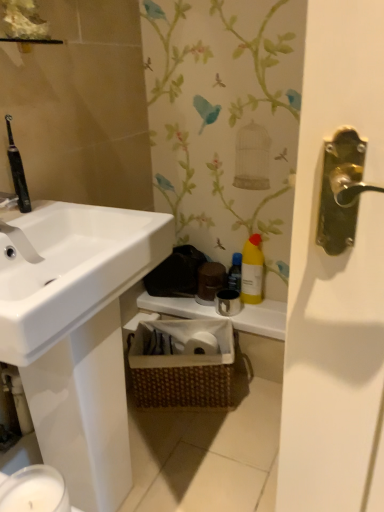
Question: Is the surface of yellow matte bottle at center in direct contact with white matte counter top at center?

Choices:
 (A) no
 (B) yes

Answer: (A)

Question: Considering the relative sizes of yellow matte bottle at center and white matte counter top at center in the image provided, is yellow matte bottle at center wider than white matte counter top at center?

Choices:
 (A) yes
 (B) no

Answer: (B)

Question: From a real-world perspective, is yellow matte bottle at center on top of white matte counter top at center?

Choices:
 (A) no
 (B) yes

Answer: (B)

Question: Is yellow matte bottle at center bigger than white matte counter top at center?

Choices:
 (A) no
 (B) yes

Answer: (A)

Question: Is yellow matte bottle at center turned away from white matte counter top at center?

Choices:
 (A) no
 (B) yes

Answer: (A)

Question: Relative to yellow plastic bottle at upper right, is woven brown basket at center in front or behind?

Choices:
 (A) front
 (B) behind

Answer: (A)

Question: Is woven brown basket at center bigger or smaller than yellow plastic bottle at upper right?

Choices:
 (A) big
 (B) small

Answer: (A)

Question: From their relative heights in the image, would you say woven brown basket at center is taller or shorter than yellow plastic bottle at upper right?

Choices:
 (A) tall
 (B) short

Answer: (B)

Question: From the image's perspective, relative to yellow plastic bottle at upper right, is woven brown basket at center above or below?

Choices:
 (A) above
 (B) below

Answer: (B)

Question: Is white matte counter top at center bigger or smaller than yellow matte bottle at center?

Choices:
 (A) big
 (B) small

Answer: (A)

Question: Is white matte counter top at center inside the boundaries of yellow matte bottle at center, or outside?

Choices:
 (A) inside
 (B) outside

Answer: (B)

Question: Does point (268, 307) appear closer or farther from the camera than point (238, 287)?

Choices:
 (A) farther
 (B) closer

Answer: (A)

Question: Looking at their shapes, would you say white matte counter top at center is wider or thinner than yellow matte bottle at center?

Choices:
 (A) thin
 (B) wide

Answer: (B)

Question: In terms of size, does yellow matte bottle at center appear bigger or smaller than yellow plastic bottle at upper right?

Choices:
 (A) big
 (B) small

Answer: (B)

Question: From the image's perspective, relative to yellow plastic bottle at upper right, is yellow matte bottle at center above or below?

Choices:
 (A) below
 (B) above

Answer: (A)